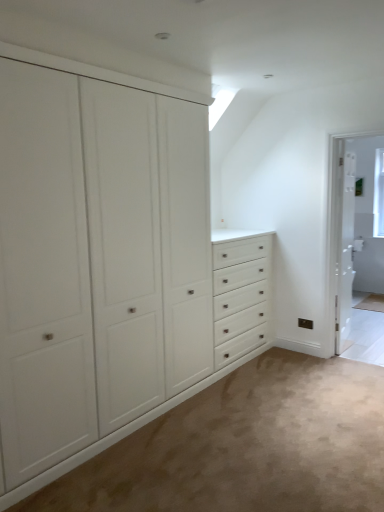
Identify the location of white glossy door at right. The height and width of the screenshot is (512, 384). (345, 249).

Is white wooden screen door at right aimed at white glossy door at right?

No, white wooden screen door at right does not turn towards white glossy door at right.

Considering the relative sizes of white wooden screen door at right and white glossy door at right in the image provided, is white wooden screen door at right bigger than white glossy door at right?

No.

Which object is positioned more to the right, white wooden screen door at right or white glossy door at right?

white glossy door at right is more to the right.

From a real-world perspective, between white matte cabinet at left and white wooden screen door at right, who is vertically lower?

In real-world perspective, white wooden screen door at right is lower.

Based on the photo, is white matte cabinet at left positioned before white wooden screen door at right?

Yes, it is in front of white wooden screen door at right.

From the picture: Is white matte cabinet at left oriented away from white wooden screen door at right?

No, white wooden screen door at right is not at the back of white matte cabinet at left.

From the image's perspective, which is above, white matte cabinet at left or white wooden screen door at right?

white wooden screen door at right is shown above in the image.

Consider the image. Which of these two, white glossy door at right or white matte cabinet at left, stands taller?

white matte cabinet at left is taller.

Is white glossy door at right touching white matte cabinet at left?

white glossy door at right and white matte cabinet at left are not in contact.

Is white matte cabinet at left at the back of white glossy door at right?

No.

Is point (352, 278) closer or farther from the camera than point (120, 432)?

Point (352, 278) is farther from the camera than point (120, 432).

Would you say white matte cabinet at left is outside white glossy door at right?

white matte cabinet at left is positioned outside white glossy door at right.

Is white matte cabinet at left looking in the opposite direction of white glossy door at right?

white matte cabinet at left is not turned away from white glossy door at right.

From the image's perspective, is white matte cabinet at left on white glossy door at right?

No, from the image's perspective, white matte cabinet at left is not above white glossy door at right.

Find the location of a particular element. The image size is (384, 512). door located underneath the white matte cabinet at left (from a real-world perspective) is located at coordinates (345, 249).

Considering the relative sizes of white wooden screen door at right and white matte cabinet at left in the image provided, is white wooden screen door at right thinner than white matte cabinet at left?

Yes, white wooden screen door at right is thinner than white matte cabinet at left.

Based on their sizes in the image, would you say white wooden screen door at right is bigger or smaller than white matte cabinet at left?

Considering their sizes, white wooden screen door at right takes up less space than white matte cabinet at left.

You are a GUI agent. You are given a task and a screenshot of the screen. Output one action in this format:
    pyautogui.click(x=<x>, y=<y>)
    Task: Click on the cupboard in front of the white wooden screen door at right
    This screenshot has height=512, width=384.
    Given the screenshot: What is the action you would take?
    pyautogui.click(x=109, y=264)

Is white glossy door at right facing away from white wooden screen door at right?

No, white glossy door at right's orientation is not away from white wooden screen door at right.

From the image's perspective, is white glossy door at right above or below white wooden screen door at right?

From the image's perspective, white glossy door at right appears above white wooden screen door at right.

Considering the positions of objects white glossy door at right and white wooden screen door at right in the image provided, who is more to the left, white glossy door at right or white wooden screen door at right?

From the viewer's perspective, white wooden screen door at right appears more on the left side.

Which object is closer to the camera, white glossy door at right or white wooden screen door at right?

white wooden screen door at right is more forward.

Identify the location of door located above the white wooden screen door at right (from the image's perspective). Image resolution: width=384 pixels, height=512 pixels. (345, 249).

You are a GUI agent. You are given a task and a screenshot of the screen. Output one action in this format:
    pyautogui.click(x=<x>, y=<y>)
    Task: Click on the cupboard on the left of white wooden screen door at right
    This screenshot has width=384, height=512.
    Given the screenshot: What is the action you would take?
    pyautogui.click(x=109, y=264)

From the image, which object appears to be farther from white wooden screen door at right, white glossy door at right or white matte cabinet at left?

The object further to white wooden screen door at right is white matte cabinet at left.

When comparing their distances from white glossy door at right, does white matte cabinet at left or white wooden screen door at right seem closer?

white wooden screen door at right is positioned closer to the anchor white glossy door at right.

Considering their positions, is white glossy door at right positioned closer to white matte cabinet at left than white wooden screen door at right?

white wooden screen door at right.

Based on their spatial positions, is white wooden screen door at right or white matte cabinet at left further from white glossy door at right?

white matte cabinet at left.

Considering their positions, is white wooden screen door at right positioned further to white matte cabinet at left than white glossy door at right?

Among the two, white glossy door at right is located further to white matte cabinet at left.

When comparing their distances from white wooden screen door at right, does white matte cabinet at left or white glossy door at right seem closer?

white glossy door at right is closer to white wooden screen door at right.

This screenshot has height=512, width=384. Find the location of `screen door situated between white matte cabinet at left and white glossy door at right from left to right`. screen door situated between white matte cabinet at left and white glossy door at right from left to right is located at coordinates (357, 227).